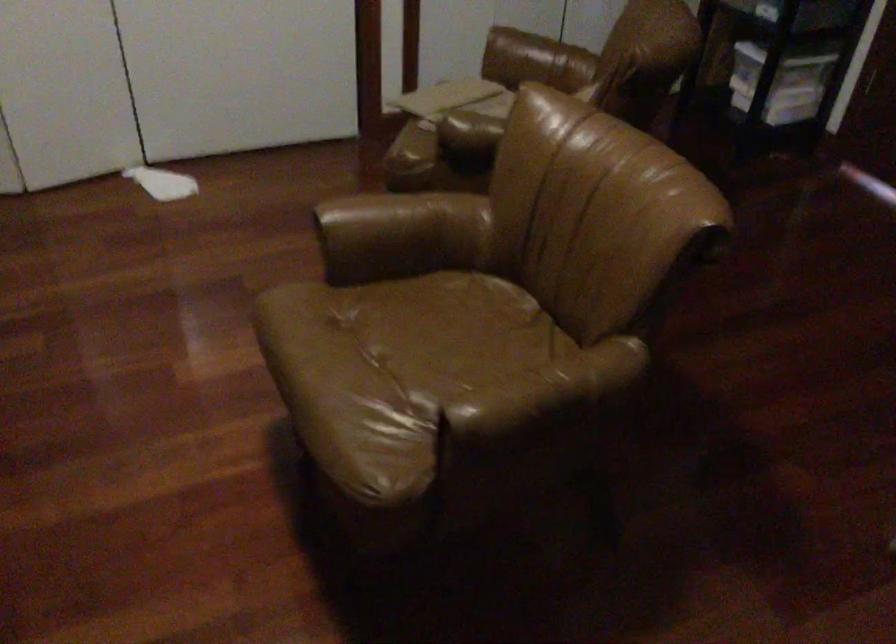
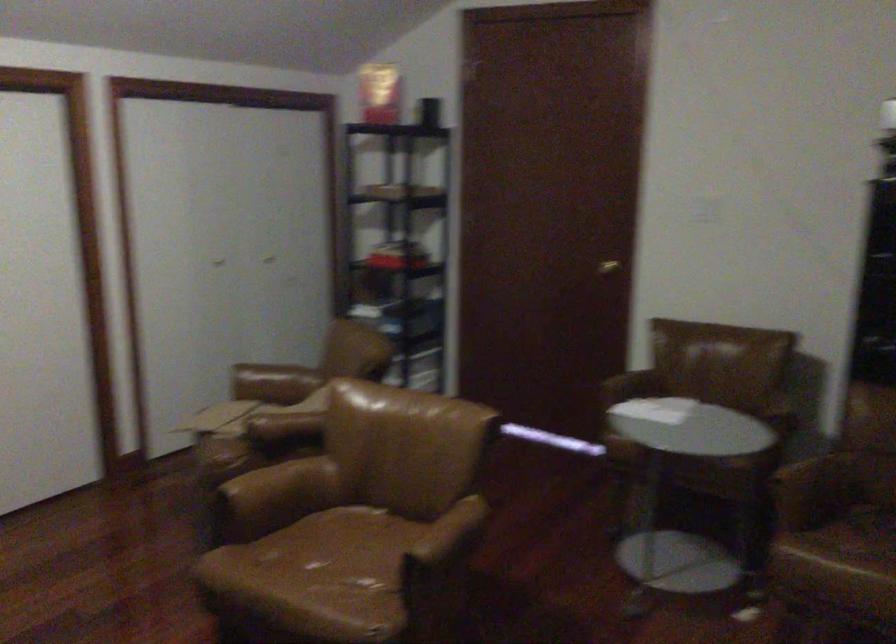
Locate, in the second image, the point that corresponds to [440,345] in the first image.

(343, 556)